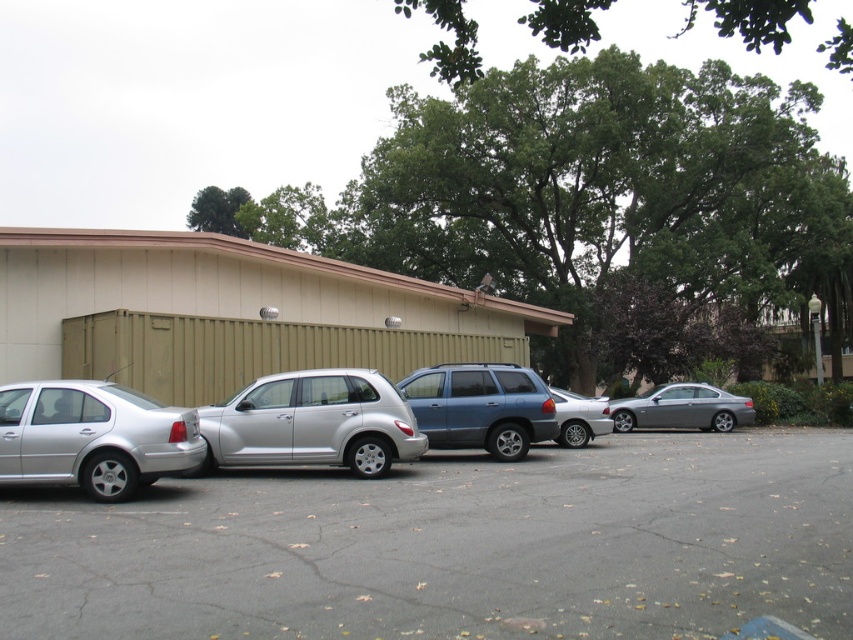
Is silver metallic hatchback at center behind blue matte suv at center?

No, it is not.

Who is higher up, silver metallic hatchback at center or blue matte suv at center?

blue matte suv at center

Does point (343, 461) lie in front of point (492, 380)?

Yes, point (343, 461) is closer to viewer.

Identify the location of silver metallic hatchback at center. The image size is (853, 640). (312, 422).

In the scene shown: Does blue matte suv at center have a greater width compared to satin silver sedan at right?

In fact, blue matte suv at center might be narrower than satin silver sedan at right.

Can you confirm if blue matte suv at center is thinner than satin silver sedan at right?

Indeed, blue matte suv at center has a lesser width compared to satin silver sedan at right.

Who is more forward, (457, 364) or (720, 422)?

Point (457, 364) is in front.

The height and width of the screenshot is (640, 853). Identify the location of blue matte suv at center. (480, 406).

Does blue matte suv at center have a lesser height compared to silver metallic sedan at center?

No.

Who is more distant from viewer, (550, 406) or (592, 433)?

The point (592, 433) is more distant.

Who is more forward, (514, 435) or (563, 422)?

Point (514, 435)

Locate an element on the screen. The height and width of the screenshot is (640, 853). blue matte suv at center is located at coordinates (480, 406).